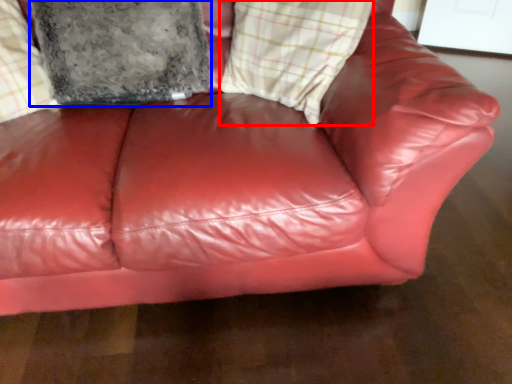
Question: Which point is further to the camera, plaid (highlighted by a red box) or pillow (highlighted by a blue box)?

Choices:
 (A) plaid
 (B) pillow

Answer: (B)